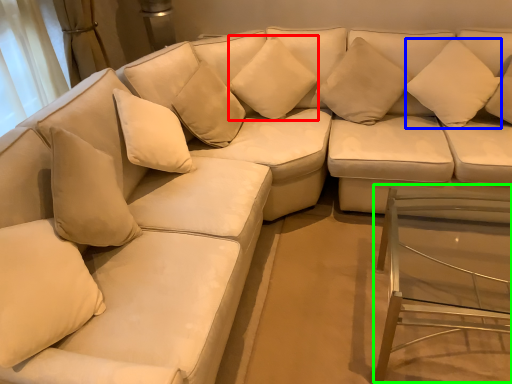
Question: Estimate the real-world distances between objects in this image. Which object is farther from pillow (highlighted by a red box), pillow (highlighted by a blue box) or glass table (highlighted by a green box)?

Choices:
 (A) pillow
 (B) glass table

Answer: (B)